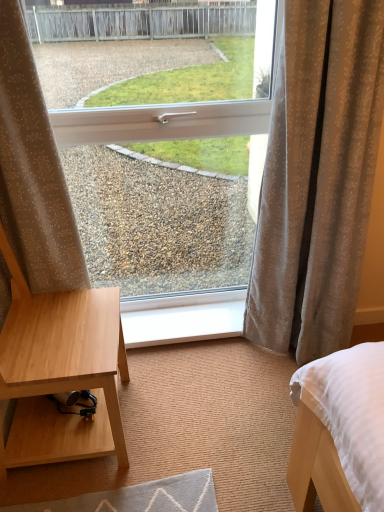
In order to click on vacant region below beige textured curtain at right, acting as the first curtain starting from the right (from a real-world perspective) in this screenshot , I will do `click(274, 358)`.